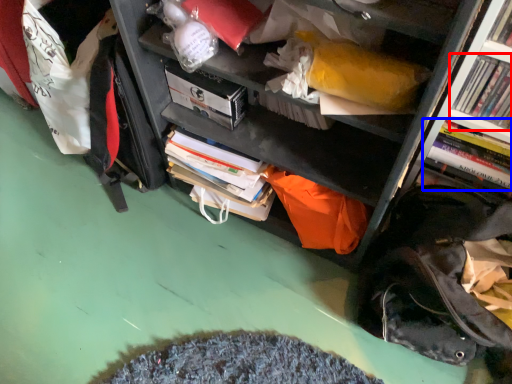
Question: Which object is closer to the camera taking this photo, book (highlighted by a red box) or book (highlighted by a blue box)?

Choices:
 (A) book
 (B) book

Answer: (A)